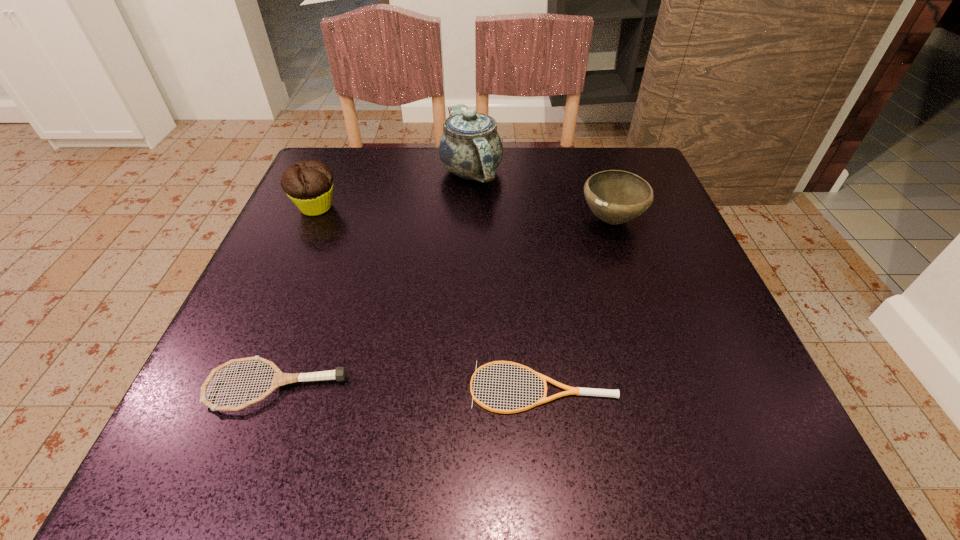
Find the location of `empty location between the left tennis racket and the chinaware`. empty location between the left tennis racket and the chinaware is located at coordinates (373, 279).

I want to click on empty space between the tallest object and the right tennis racket, so click(x=507, y=280).

What are the coordinates of `vacant space that is in between the shorter tennis racket and the muffin` in the screenshot? It's located at (429, 298).

What are the coordinates of `free space between the bowl and the left tennis racket` in the screenshot? It's located at (444, 303).

Locate an element on the screen. unoccupied area between the tallest object and the muffin is located at coordinates (394, 190).

Image resolution: width=960 pixels, height=540 pixels. Identify the location of vacant area that lies between the taller tennis racket and the rightmost object. point(444,303).

The image size is (960, 540). Find the location of `unoccupied area between the second tallest object and the third shortest object`. unoccupied area between the second tallest object and the third shortest object is located at coordinates (464, 213).

You are a GUI agent. You are given a task and a screenshot of the screen. Output one action in this format:
    pyautogui.click(x=<x>, y=<y>)
    Task: Click on the free area in between the bowl and the chinaware
    
    Given the screenshot: What is the action you would take?
    pyautogui.click(x=541, y=195)

Image resolution: width=960 pixels, height=540 pixels. I want to click on vacant point located between the third tallest object and the fourth tallest object, so click(444, 303).

What are the coordinates of `object identified as the closest to the shortest object` in the screenshot? It's located at (279, 379).